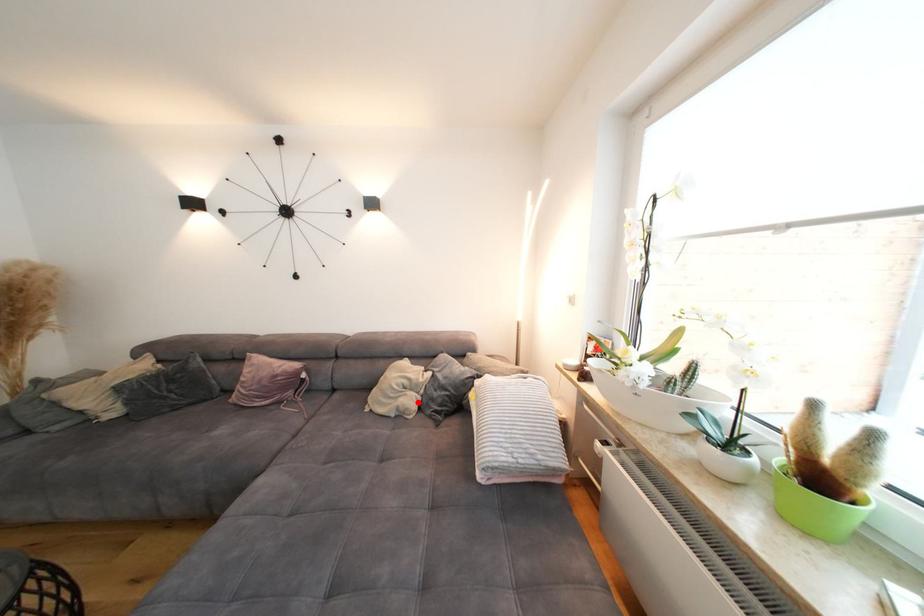
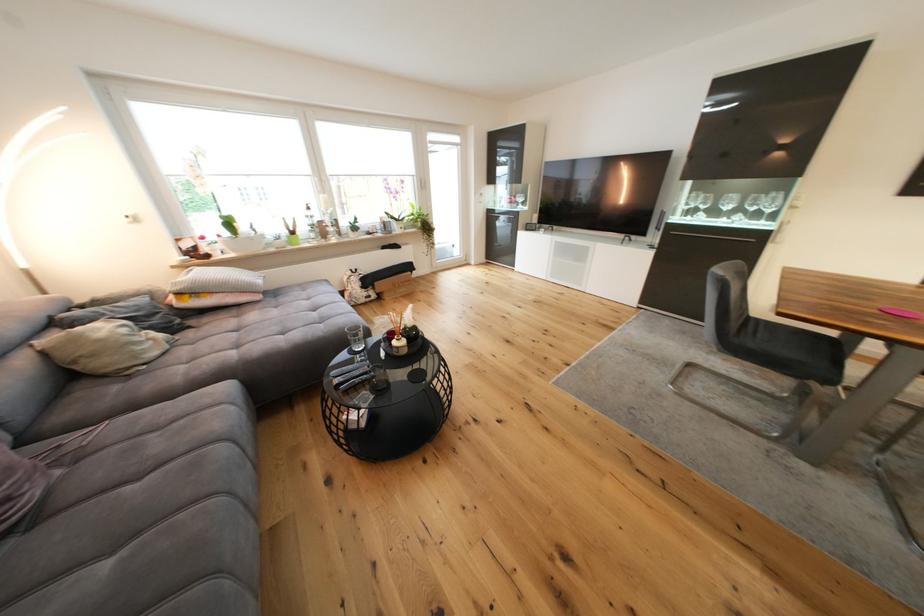
Locate, in the second image, the point that corresponds to the highlighted location in the first image.

(161, 336)